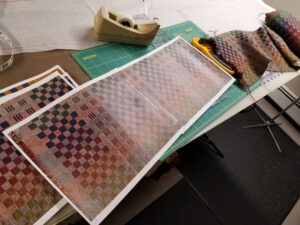
You are a GUI agent. You are given a task and a screenshot of the screen. Output one action in this format:
    pyautogui.click(x=<x>, y=<y>)
    Task: Click on the wall
    The width and height of the screenshot is (300, 225).
    Given the screenshot: What is the action you would take?
    pyautogui.click(x=291, y=5)